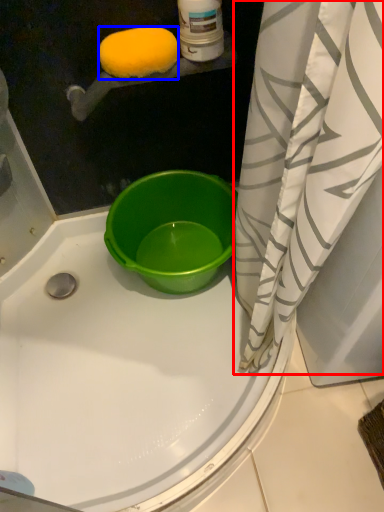
Question: Which object appears farthest to the camera in this image, curtain (highlighted by a red box) or lemon (highlighted by a blue box)?

Choices:
 (A) curtain
 (B) lemon

Answer: (B)